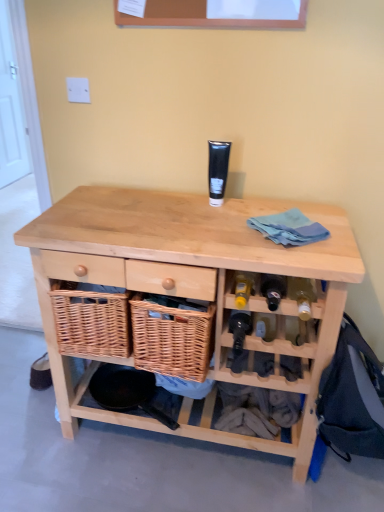
Identify the location of vacant space to the left of black matte tube at center. (174, 204).